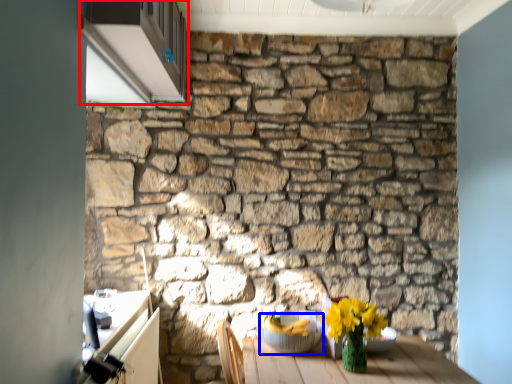
Question: Which point is further to the camera, window (highlighted by a red box) or glass bowl (highlighted by a blue box)?

Choices:
 (A) window
 (B) glass bowl

Answer: (B)